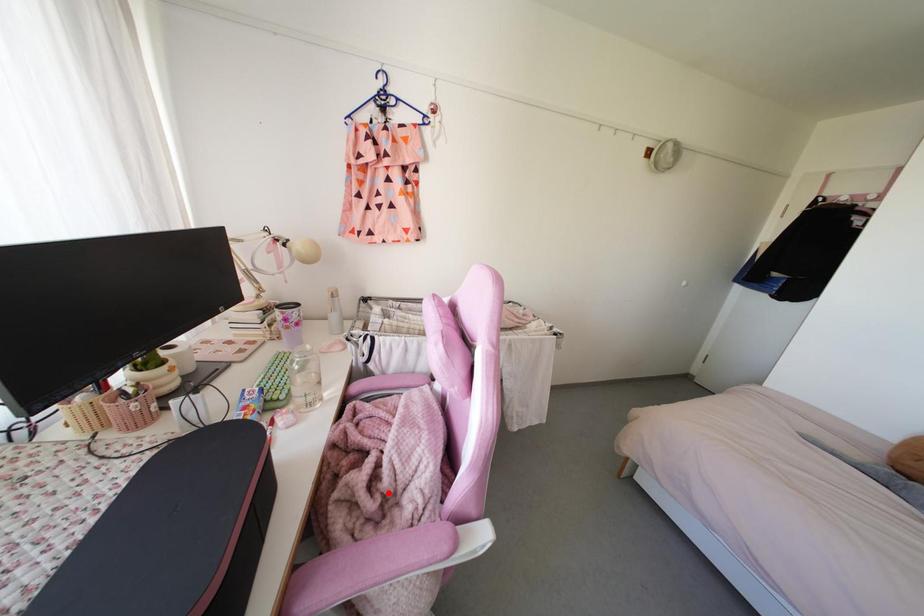
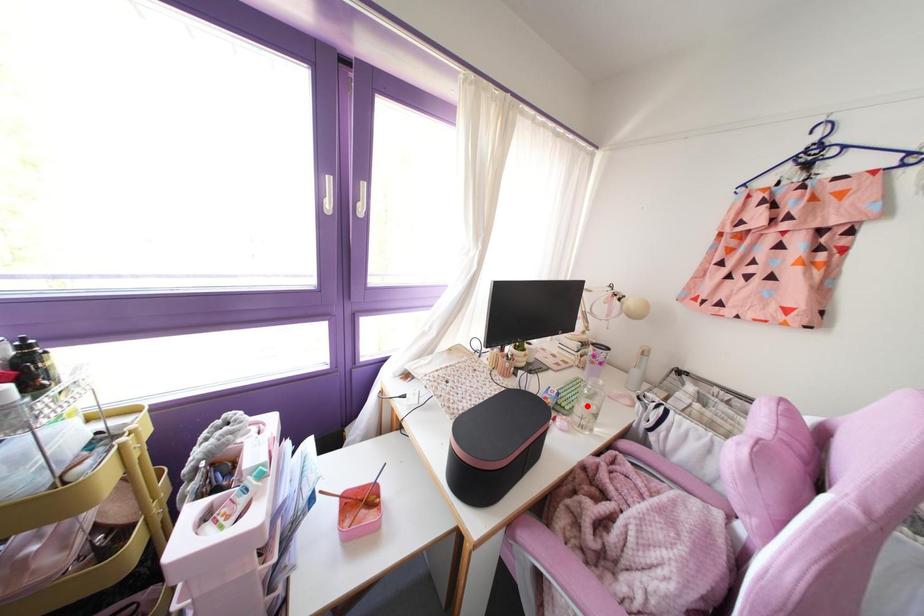
I am providing you with two images of the same scene from different viewpoints. A red point is marked on the first image and another point is marked on the second image. Is the marked point in image1 the same physical position as the marked point in image2?

No